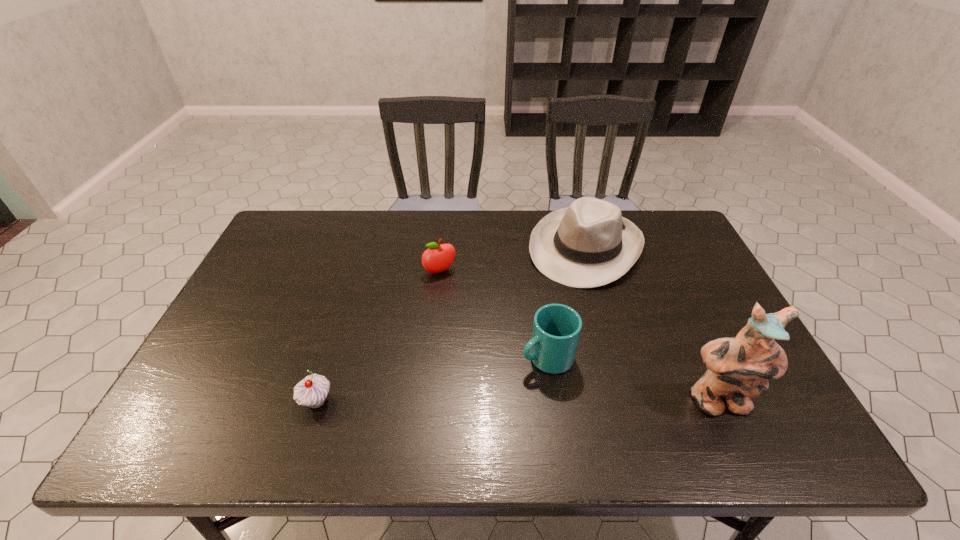
Image resolution: width=960 pixels, height=540 pixels. In order to click on vacant space on the desktop that is between the cupcake and the tallest object and is positioned on the front-facing side of the fedora in this screenshot , I will do `click(492, 402)`.

The height and width of the screenshot is (540, 960). Identify the location of free space on the desktop that is between the cupcake and the tallest object and is positioned on the handle side of the cup. (460, 402).

Identify the location of free spot on the desktop that is between the leftmost object and the tallest object and is positioned on the front-facing side of the apple. (515, 402).